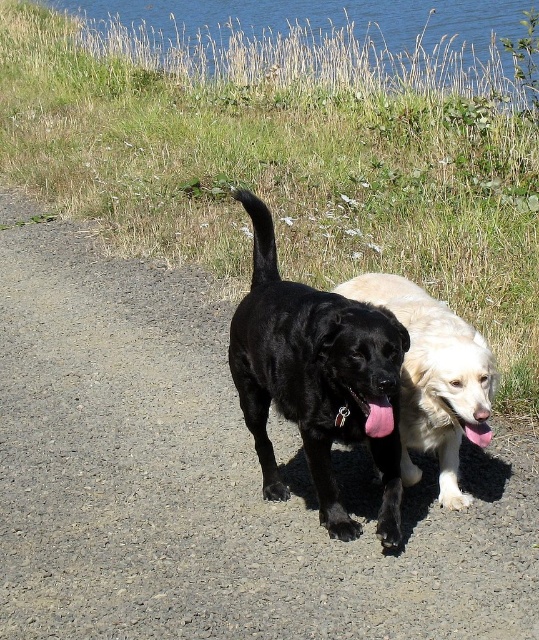
Question: Estimate the real-world distances between objects in this image. Which object is farther from the pink fabric tongue at center?

Choices:
 (A) blue water at upper center
 (B) gravel path at center
 (C) black matte dog at center

Answer: (A)

Question: Does black matte dog at center lie in front of shiny golden fur at center?

Choices:
 (A) no
 (B) yes

Answer: (B)

Question: Which point appears closest to the camera in this image?

Choices:
 (A) (94, 353)
 (B) (178, 4)
 (C) (331, 509)
 (D) (468, 436)

Answer: (D)

Question: Which object appears farthest from the camera in this image?

Choices:
 (A) pink fabric tongue at center
 (B) pink glossy tongue at center

Answer: (B)

Question: In this image, where is shiny golden fur at center located relative to pink fabric tongue at center?

Choices:
 (A) right
 (B) left

Answer: (A)

Question: Does gravel path at center have a larger size compared to pink glossy tongue at center?

Choices:
 (A) no
 (B) yes

Answer: (B)